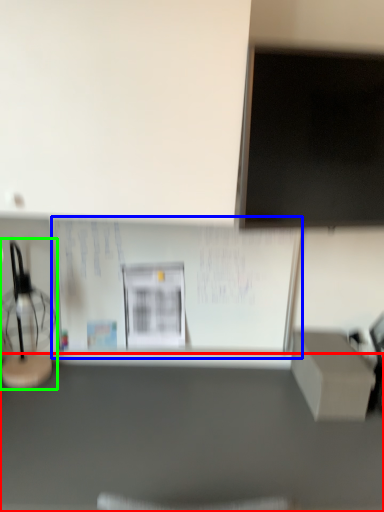
Question: Which object is the farthest from furniture (highlighted by a red box)? Choose among these: bulletin board (highlighted by a blue box) or table lamp (highlighted by a green box).

Choices:
 (A) bulletin board
 (B) table lamp

Answer: (B)